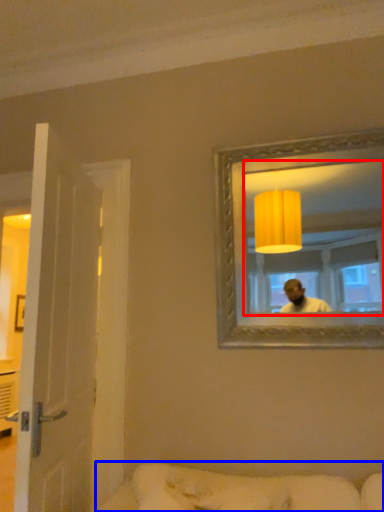
Question: Which of the following is the closest to the observer, mirror (highlighted by a red box) or studio couch (highlighted by a blue box)?

Choices:
 (A) mirror
 (B) studio couch

Answer: (B)